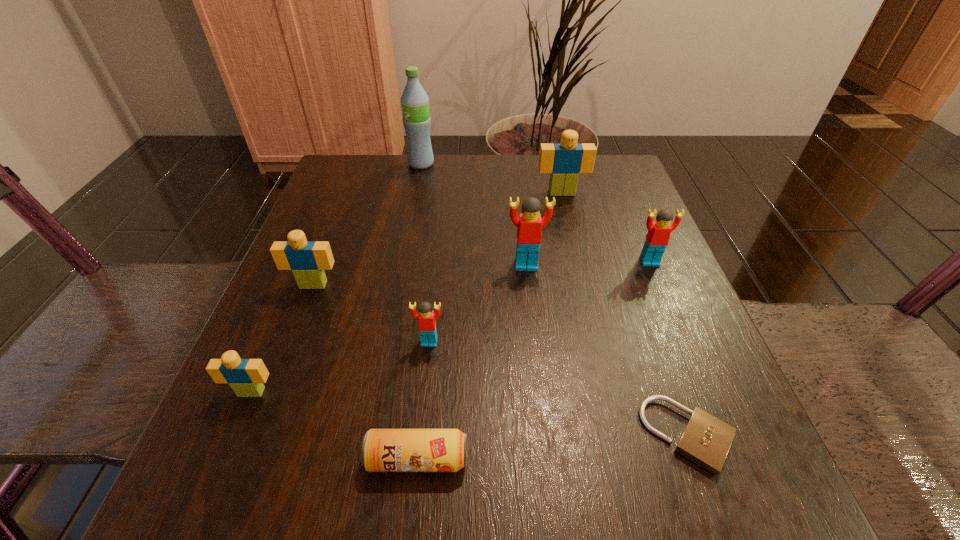
Locate which object ranks second in proximity to the rightmost red Lego. Please provide its 2D coordinates. Your answer should be formatted as a tuple, i.e. [(x, y)], where the tuple contains the x and y coordinates of a point satisfying the conditions above.

[(564, 161)]

Where is `the third closest object relative to the fifth nearest object`? The image size is (960, 540). the third closest object relative to the fifth nearest object is located at coordinates (383, 450).

Identify which Lego is located as the third nearest to the second smallest red Lego. Please provide its 2D coordinates. Your answer should be formatted as a tuple, i.e. [(x, y)], where the tuple contains the x and y coordinates of a point satisfying the conditions above.

[(426, 319)]

Locate which Lego ranks fifth in proximity to the water bottle. Please provide its 2D coordinates. Your answer should be formatted as a tuple, i.e. [(x, y)], where the tuple contains the x and y coordinates of a point satisfying the conditions above.

[(657, 238)]

Identify which beige Lego is the nearest to the beige padlock. Please provide its 2D coordinates. Your answer should be formatted as a tuple, i.e. [(x, y)], where the tuple contains the x and y coordinates of a point satisfying the conditions above.

[(564, 161)]

Where is `beige Lego that is the second closest one to the sixth object from left to right`? The height and width of the screenshot is (540, 960). beige Lego that is the second closest one to the sixth object from left to right is located at coordinates (307, 259).

Choose which red Lego is the nearest neighbor to the padlock. Please provide its 2D coordinates. Your answer should be formatted as a tuple, i.e. [(x, y)], where the tuple contains the x and y coordinates of a point satisfying the conditions above.

[(657, 238)]

The height and width of the screenshot is (540, 960). Find the location of `red Lego that is the second nearest to the leftmost red Lego`. red Lego that is the second nearest to the leftmost red Lego is located at coordinates (657, 238).

This screenshot has height=540, width=960. Identify the location of blank space that satisfies the following two spatial constraints: 1. on the face of the second shortest object; 2. on the left side of the smallest beige Lego. (224, 459).